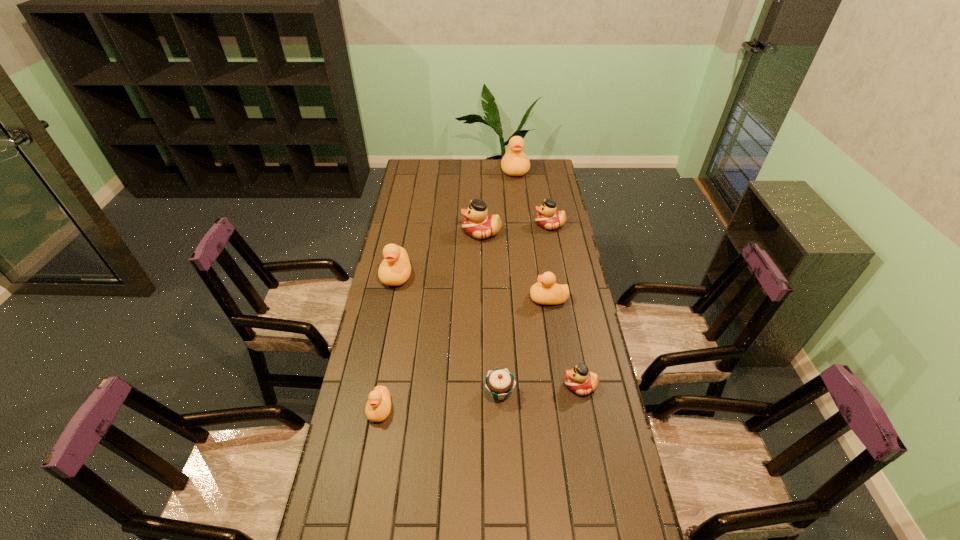
At what (x,y) coordinates should I click in order to perform the action: click on the seventh closest object to the second biggest red duck. Please return your answer as a coordinate pair (x, y). Looking at the image, I should click on (378, 407).

Where is `object that stands as the closest to the third biggest yellow duck`? This screenshot has width=960, height=540. object that stands as the closest to the third biggest yellow duck is located at coordinates (579, 379).

Identify the location of duck object that ranks as the second closest to the third biggest yellow duck. This screenshot has height=540, width=960. (478, 224).

Select which duck appears as the closest to the cupcake. Please provide its 2D coordinates. Your answer should be formatted as a tuple, i.e. [(x, y)], where the tuple contains the x and y coordinates of a point satisfying the conditions above.

[(579, 379)]

The height and width of the screenshot is (540, 960). Find the location of `yellow duck that stands as the third closest to the second smallest red duck`. yellow duck that stands as the third closest to the second smallest red duck is located at coordinates (395, 269).

This screenshot has height=540, width=960. I want to click on yellow duck that can be found as the closest to the biggest yellow duck, so click(x=395, y=269).

Identify which red duck is the second nearest to the cupcake. Please provide its 2D coordinates. Your answer should be formatted as a tuple, i.e. [(x, y)], where the tuple contains the x and y coordinates of a point satisfying the conditions above.

[(478, 224)]

Locate which red duck ranks in proximity to the cupcake. Please provide its 2D coordinates. Your answer should be formatted as a tuple, i.e. [(x, y)], where the tuple contains the x and y coordinates of a point satisfying the conditions above.

[(579, 379)]

Locate an element on the screen. The image size is (960, 540). vacant point that satisfies the following two spatial constraints: 1. on the face of the biggest red duck; 2. on the back side of the cupcake is located at coordinates (482, 393).

You are a GUI agent. You are given a task and a screenshot of the screen. Output one action in this format:
    pyautogui.click(x=<x>, y=<y>)
    Task: Click on the free space that satisfies the following two spatial constraints: 1. on the face of the leftmost red duck; 2. on the face of the nearest yellow duck
    This screenshot has height=540, width=960.
    Given the screenshot: What is the action you would take?
    pyautogui.click(x=482, y=409)